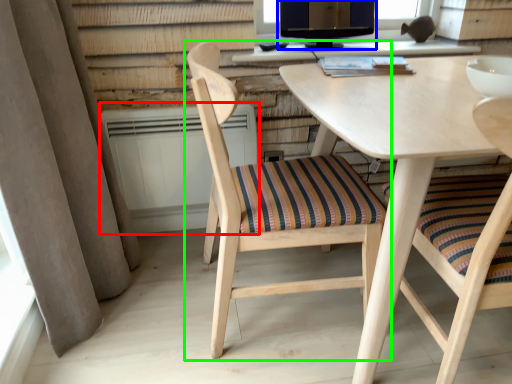
Question: Which object is the closest to the radiator (highlighted by a red box)? Choose among these: computer monitor (highlighted by a blue box) or chair (highlighted by a green box).

Choices:
 (A) computer monitor
 (B) chair

Answer: (B)